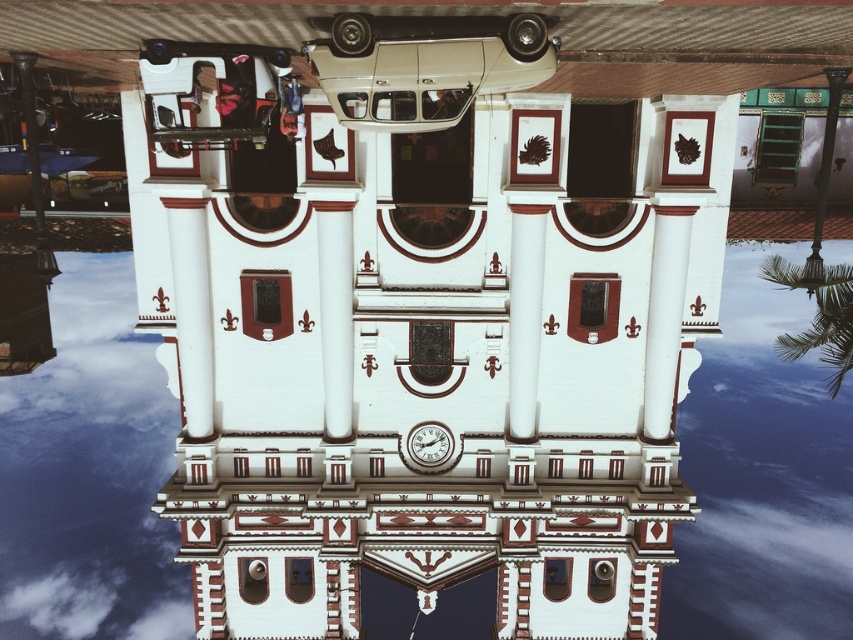
Does point (751, 246) come in front of point (409, 440)?

No.

Measure the distance between transparent glass water at center and camera.

transparent glass water at center is 283.52 feet away from camera.

Does point (728, 438) lie in front of point (405, 445)?

No, (728, 438) is behind (405, 445).

You are a GUI agent. You are given a task and a screenshot of the screen. Output one action in this format:
    pyautogui.click(x=<x>, y=<y>)
    Task: Click on the transparent glass water at center
    This screenshot has width=853, height=640.
    Given the screenshot: What is the action you would take?
    pyautogui.click(x=90, y=474)

Does transparent glass water at center have a lesser height compared to white glossy column at center?

No, transparent glass water at center is not shorter than white glossy column at center.

Does transparent glass water at center have a smaller size compared to white glossy column at center?

Incorrect, transparent glass water at center is not smaller in size than white glossy column at center.

The width and height of the screenshot is (853, 640). What do you see at coordinates (90, 474) in the screenshot? I see `transparent glass water at center` at bounding box center [90, 474].

The image size is (853, 640). I want to click on transparent glass water at center, so click(x=90, y=474).

The image size is (853, 640). What do you see at coordinates (524, 317) in the screenshot?
I see `white glossy column at center` at bounding box center [524, 317].

Is point (514, 301) positioned in front of point (427, 429)?

Yes, it is in front of point (427, 429).

Who is more distant from viewer, (535, 228) or (448, 451)?

The point (448, 451) is behind.

The image size is (853, 640). I want to click on white glossy column at center, so click(524, 317).